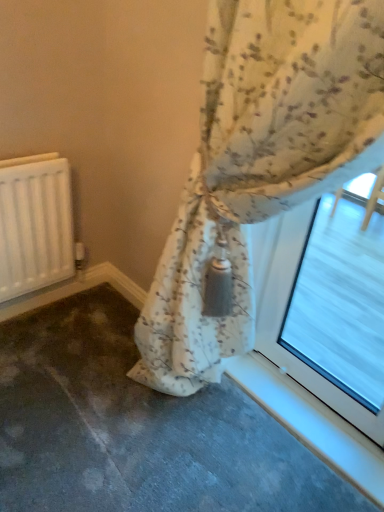
Question: Is white matte radiator at left not inside transparent glass at upper right?

Choices:
 (A) yes
 (B) no

Answer: (A)

Question: Considering the relative sizes of white matte radiator at left and transparent glass at upper right in the image provided, is white matte radiator at left wider than transparent glass at upper right?

Choices:
 (A) yes
 (B) no

Answer: (A)

Question: Is white matte radiator at left behind transparent glass at upper right?

Choices:
 (A) no
 (B) yes

Answer: (B)

Question: From a real-world perspective, is white matte radiator at left below transparent glass at upper right?

Choices:
 (A) yes
 (B) no

Answer: (A)

Question: From the image's perspective, is white matte radiator at left on top of transparent glass at upper right?

Choices:
 (A) no
 (B) yes

Answer: (B)

Question: Visually, is white matte radiator at left positioned to the left or to the right of transparent glass at upper right?

Choices:
 (A) left
 (B) right

Answer: (A)

Question: Relative to transparent glass at upper right, is white matte radiator at left in front or behind?

Choices:
 (A) front
 (B) behind

Answer: (B)

Question: Choose the correct answer: Is white matte radiator at left inside transparent glass at upper right or outside it?

Choices:
 (A) outside
 (B) inside

Answer: (A)

Question: Considering the positions of white matte radiator at left and transparent glass at upper right in the image, is white matte radiator at left wider or thinner than transparent glass at upper right?

Choices:
 (A) wide
 (B) thin

Answer: (A)

Question: In the image, is floral fabric curtain at center on the left side or the right side of transparent glass at upper right?

Choices:
 (A) right
 (B) left

Answer: (B)

Question: Is point [x=263, y=7] positioned closer to the camera than point [x=339, y=345]?

Choices:
 (A) farther
 (B) closer

Answer: (B)

Question: Is floral fabric curtain at center inside or outside of transparent glass at upper right?

Choices:
 (A) outside
 (B) inside

Answer: (A)

Question: From the image's perspective, is floral fabric curtain at center located above or below transparent glass at upper right?

Choices:
 (A) above
 (B) below

Answer: (A)

Question: Is transparent glass at upper right taller or shorter than floral fabric curtain at center?

Choices:
 (A) short
 (B) tall

Answer: (A)

Question: Looking at their shapes, would you say transparent glass at upper right is wider or thinner than floral fabric curtain at center?

Choices:
 (A) wide
 (B) thin

Answer: (B)